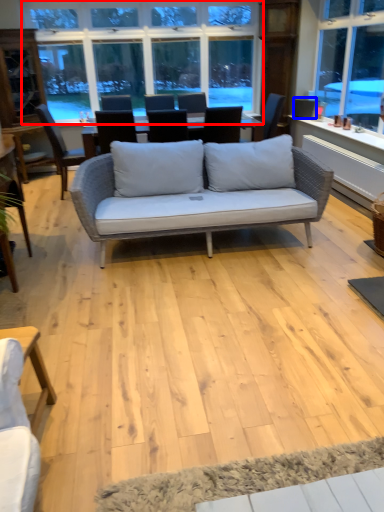
Question: Which object appears farthest to the camera in this image, window (highlighted by a red box) or armchair (highlighted by a blue box)?

Choices:
 (A) window
 (B) armchair

Answer: (B)